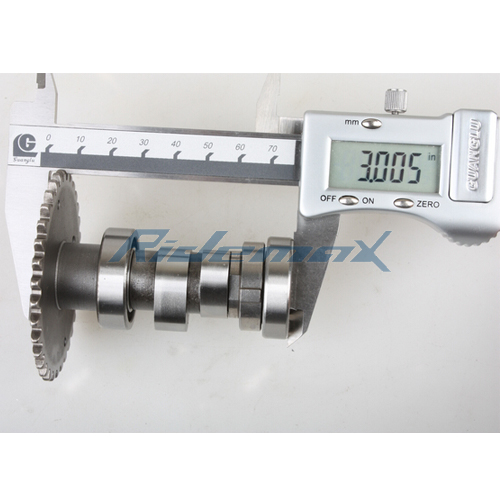
The width and height of the screenshot is (500, 500). What are the coordinates of `digital screen` in the screenshot? It's located at pyautogui.click(x=345, y=164).